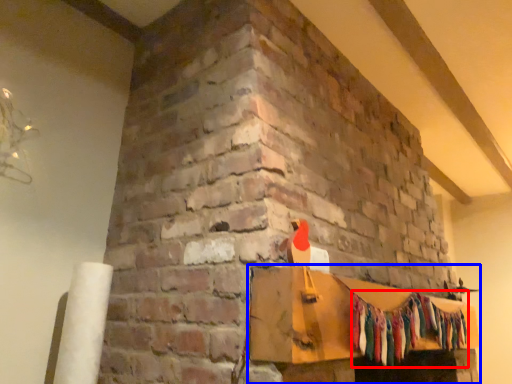
Question: Which of the following is the closest to the observer, clothing (highlighted by a red box) or furniture (highlighted by a blue box)?

Choices:
 (A) clothing
 (B) furniture

Answer: (B)